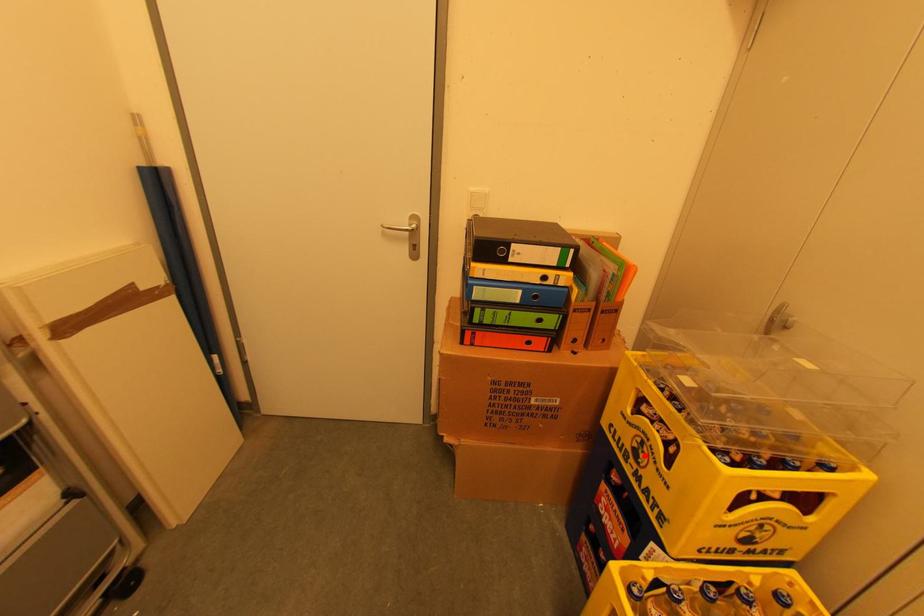
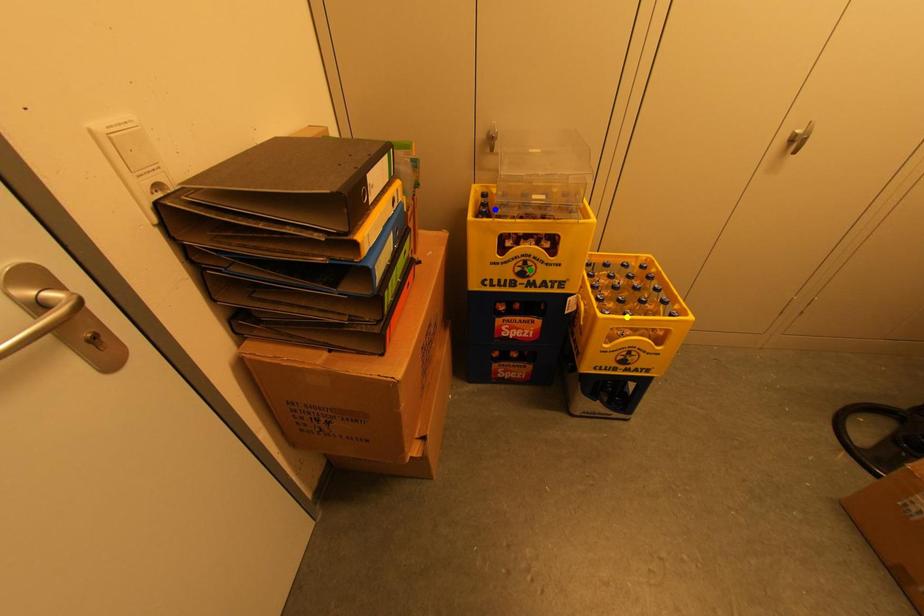
Question: I am providing you with two images of the same scene from different viewpoints. A red point is marked on the first image. You are given multiple points on the second image. Which point in image 2 is actually the same real-world point as the red point in image 1?

Choices:
 (A) blue point
 (B) yellow point
 (C) green point

Answer: (C)